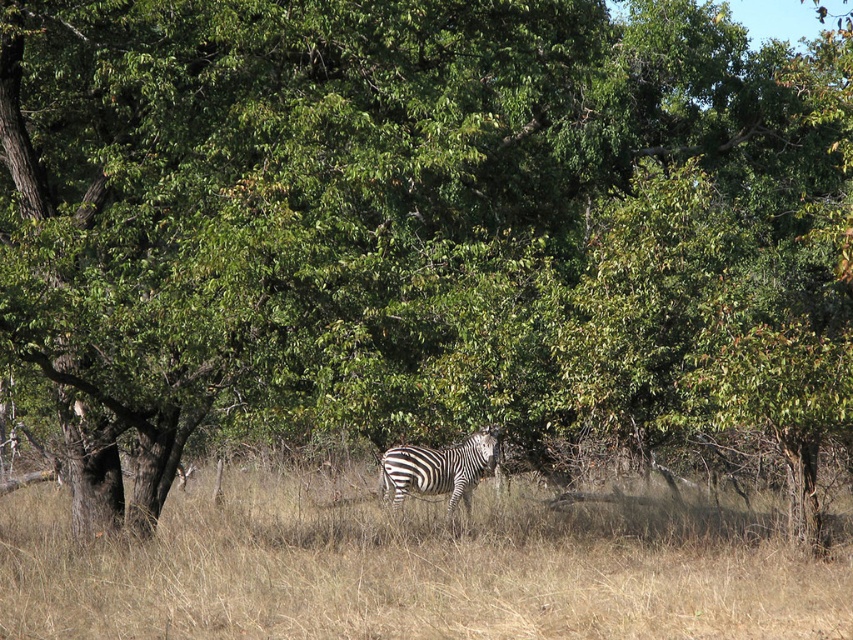
Measure the distance between dry grass at center and black and white striped zebra at center.

A distance of 2.18 meters exists between dry grass at center and black and white striped zebra at center.

Describe the element at coordinates (410, 570) in the screenshot. I see `dry grass at center` at that location.

Is point (744, 554) positioned in front of point (448, 502)?

Yes, point (744, 554) is closer to viewer.

At what (x,y) coordinates should I click in order to perform the action: click on dry grass at center. Please return your answer as a coordinate pair (x, y). Looking at the image, I should click on (410, 570).